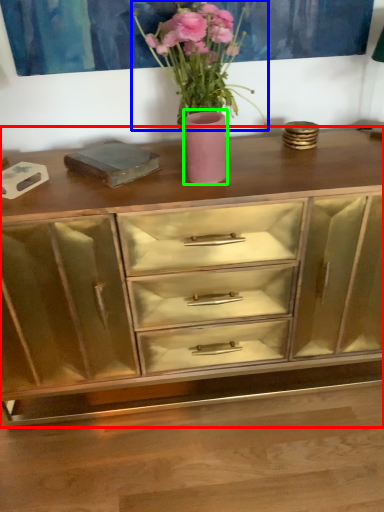
Question: Estimate the real-world distances between objects in this image. Which object is closer to chest of drawers (highlighted by a red box), floral arrangement (highlighted by a blue box) or vase (highlighted by a green box)?

Choices:
 (A) floral arrangement
 (B) vase

Answer: (B)